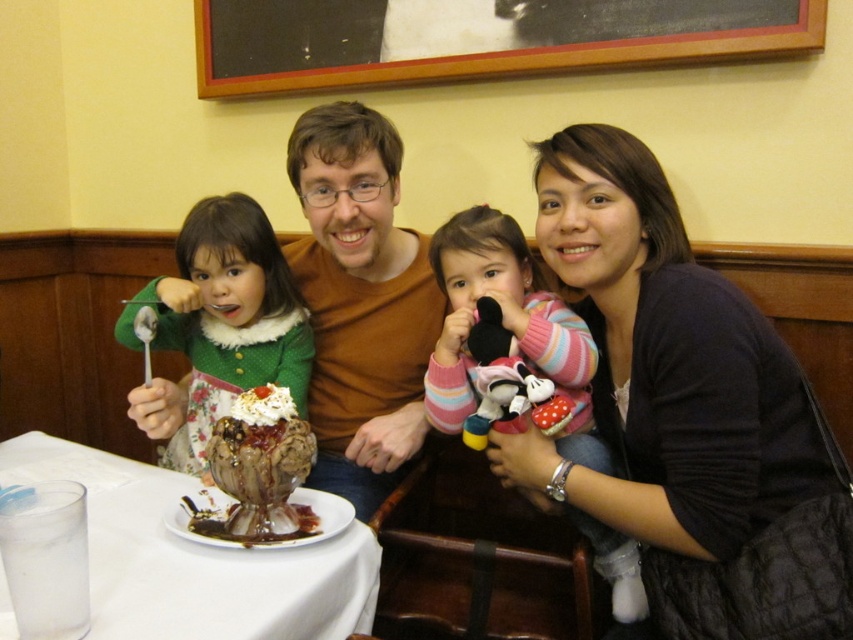
You are a server at the restaurant and need to deliver a dessert plate to the table. The dessert plate is 10 inches in diameter. There is space between the matte brown sweater at center and the green fuzzy sweater at left. Can the dessert plate fit in that space?

The space between the matte brown sweater at center and the green fuzzy sweater at left is 23.29 inches. Since the dessert plate is only 10 inches in diameter, it can easily fit in the space between them.

Based on the photo, you are a restaurant server who needs to place a new dessert plate between the matte brown sweater at center and the green fuzzy sweater at left. Can you fit it there?

The matte brown sweater at center is wider than the green fuzzy sweater at left, so there might not be enough space between them to fit the dessert plate comfortably.